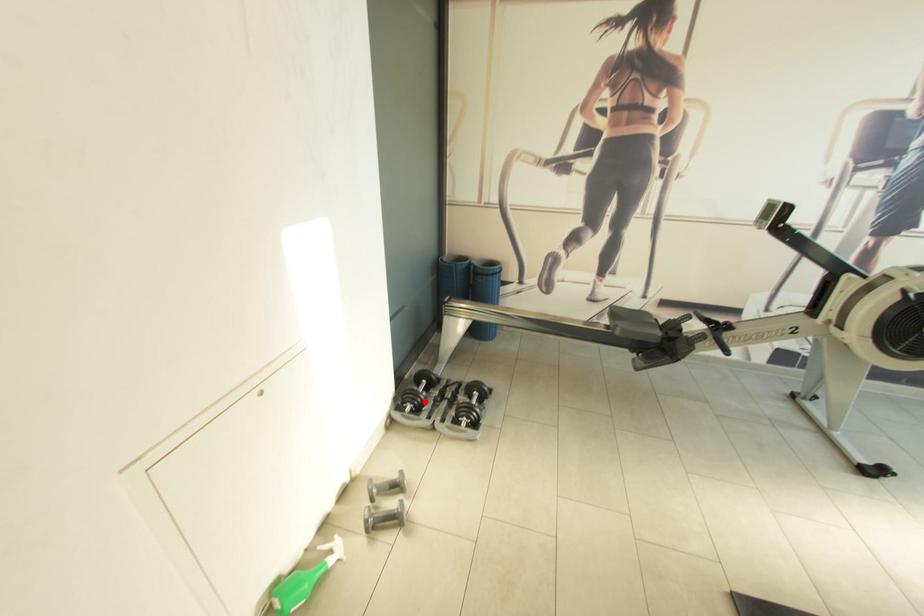
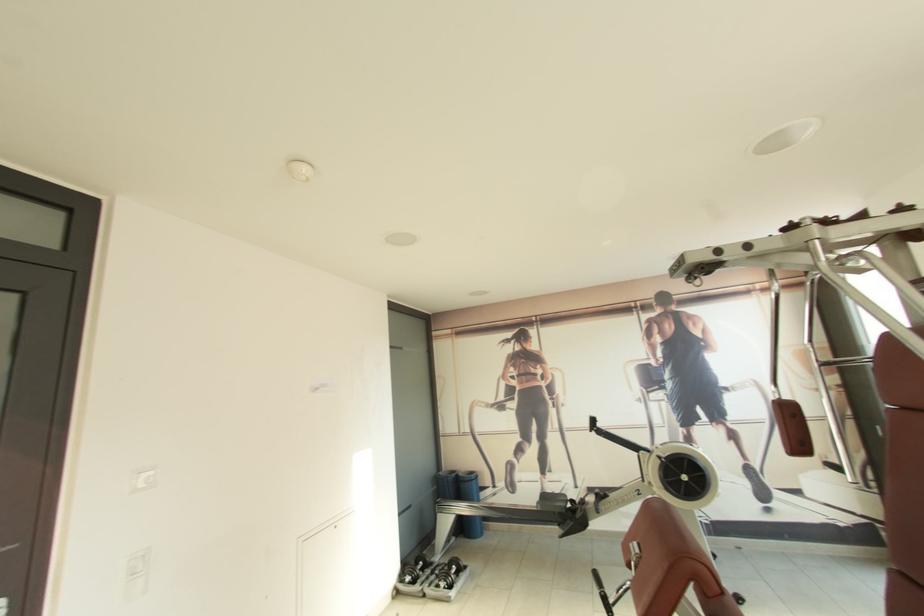
In the second image, find the point that corresponds to the highlighted location in the first image.

(419, 575)